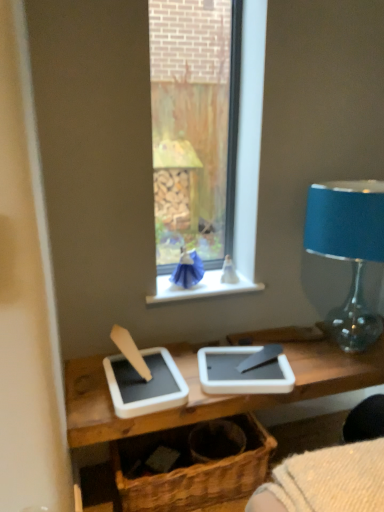
Question: From a real-world perspective, is brown woven basket at center physically below white plastic window sill at center?

Choices:
 (A) no
 (B) yes

Answer: (B)

Question: Considering the relative sizes of brown woven basket at center and white plastic window sill at center in the image provided, is brown woven basket at center wider than white plastic window sill at center?

Choices:
 (A) yes
 (B) no

Answer: (A)

Question: Is brown woven basket at center smaller than white plastic window sill at center?

Choices:
 (A) yes
 (B) no

Answer: (B)

Question: Can you confirm if brown woven basket at center is taller than white plastic window sill at center?

Choices:
 (A) no
 (B) yes

Answer: (B)

Question: From a real-world perspective, is brown woven basket at center physically above white plastic window sill at center?

Choices:
 (A) no
 (B) yes

Answer: (A)

Question: Is brown woven basket at center positioned with its back to white plastic window sill at center?

Choices:
 (A) yes
 (B) no

Answer: (B)

Question: Can you confirm if white plastic window sill at center is taller than blue glass lampshade at right?

Choices:
 (A) yes
 (B) no

Answer: (B)

Question: Is there a large distance between white plastic window sill at center and blue glass lampshade at right?

Choices:
 (A) no
 (B) yes

Answer: (A)

Question: Can you see white plastic window sill at center touching blue glass lampshade at right?

Choices:
 (A) yes
 (B) no

Answer: (B)

Question: From a real-world perspective, is white plastic window sill at center on top of blue glass lampshade at right?

Choices:
 (A) no
 (B) yes

Answer: (A)

Question: Is blue glass lampshade at right located within white plastic window sill at center?

Choices:
 (A) yes
 (B) no

Answer: (B)

Question: Can you confirm if white plastic window sill at center is bigger than blue glass lampshade at right?

Choices:
 (A) no
 (B) yes

Answer: (A)

Question: Is blue glass lampshade at right a part of brown woven basket at center?

Choices:
 (A) yes
 (B) no

Answer: (B)